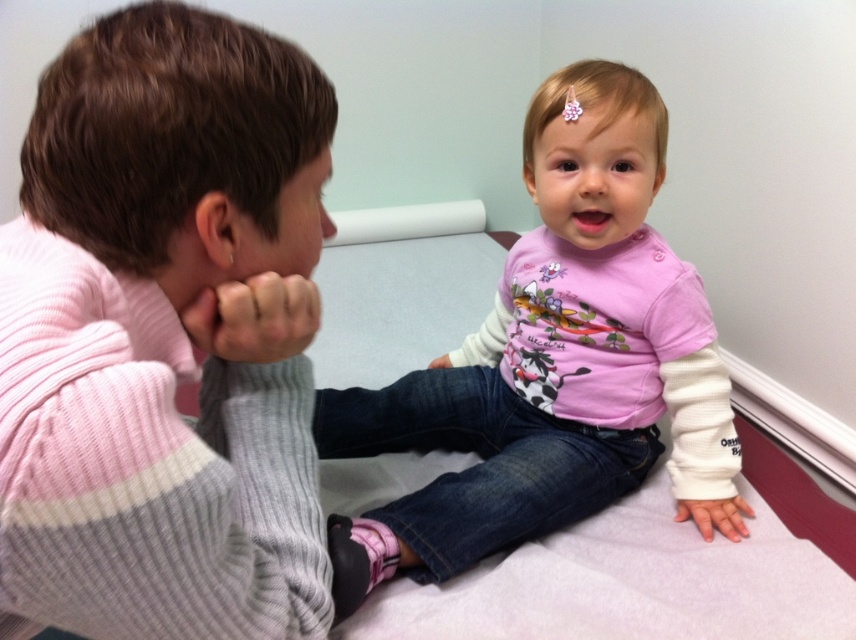
Where is the pink ribbed sweater at left located in the image?

The pink ribbed sweater at left is located at point (165, 337) in the image.

You are a medical assistant preparing to take a patient history. You notice two layers of clothing on the adult patient at the left side of the examination table. Which sweater is closer to the top, the pink ribbed sweater at left or the matte gray sweater at left?

The pink ribbed sweater at left is positioned under the matte gray sweater at left, so the matte gray sweater at left is the one closer to the top.

You are a nurse in a pediatrician office. You need to locate the pink matte shirt at center and the pink matte hair clip at upper center for a medical procedure. Based on their positions, which one is closer to the ceiling?

The pink matte hair clip at upper center is closer to the ceiling since it is located above the pink matte shirt at center.